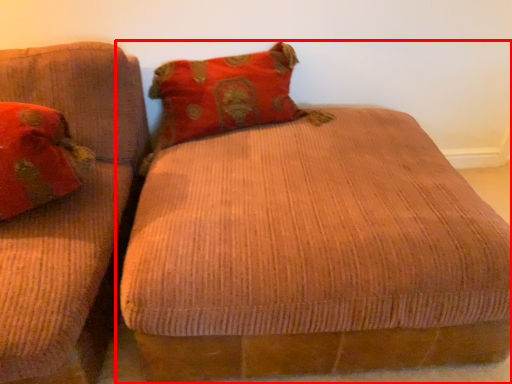
Question: Considering the relative positions of studio couch (annotated by the red box) and pillow in the image provided, where is studio couch (annotated by the red box) located with respect to the staircase?

Choices:
 (A) right
 (B) left

Answer: (A)